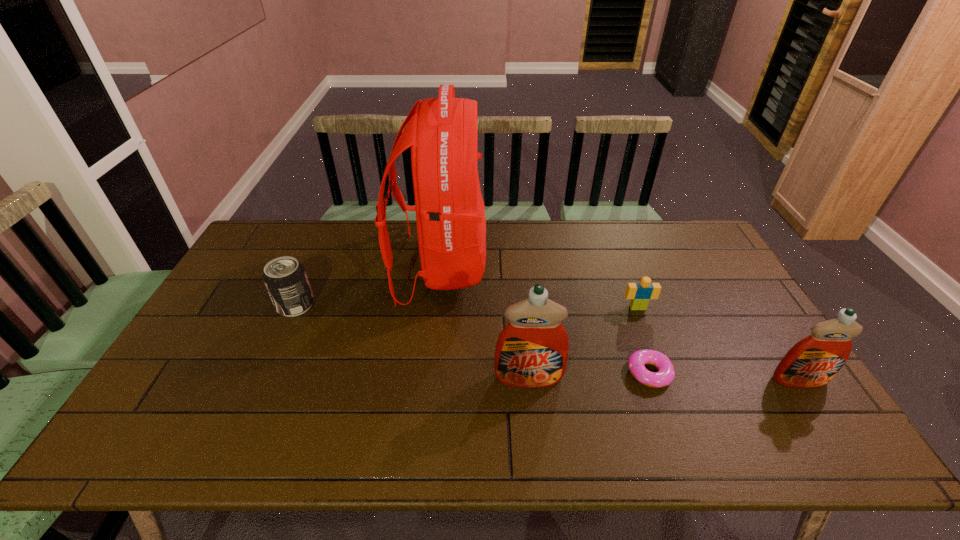
Where is `object that is the fourth closest to the Lego`? The image size is (960, 540). object that is the fourth closest to the Lego is located at coordinates (442, 132).

Identify the location of object that is the fourth closest to the third shortest object. This screenshot has height=540, width=960. (640, 293).

Where is `free space that satisfies the following two spatial constraints: 1. on the main compartment of the shortest object; 2. on the right side of the backpack`? The height and width of the screenshot is (540, 960). free space that satisfies the following two spatial constraints: 1. on the main compartment of the shortest object; 2. on the right side of the backpack is located at coordinates (429, 373).

I want to click on vacant position in the image that satisfies the following two spatial constraints: 1. on the back side of the doughnut; 2. on the main compartment of the second object from left to right, so click(612, 267).